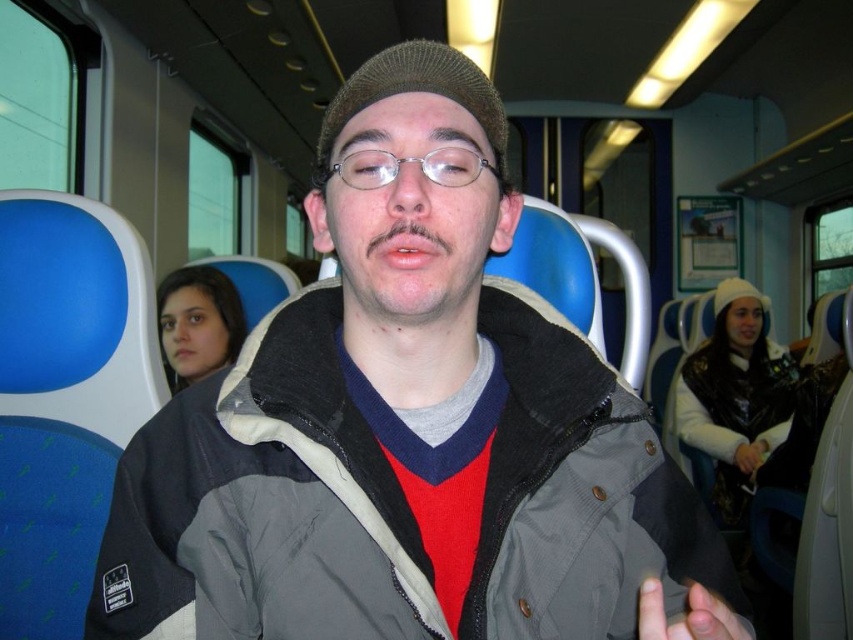
Question: Does clear plastic glasses at center have a smaller size compared to smooth skin hand at lower right?

Choices:
 (A) no
 (B) yes

Answer: (B)

Question: Does clear plastic glasses at center have a greater width compared to smooth skin hand at center?

Choices:
 (A) no
 (B) yes

Answer: (B)

Question: Estimate the real-world distances between objects in this image. Which object is farther from the smooth skin hand at center?

Choices:
 (A) clear plastic glasses at center
 (B) smooth skin hand at lower right

Answer: (A)

Question: Observing the image, what is the correct spatial positioning of clear plastic glasses at center in reference to smooth skin hand at center?

Choices:
 (A) right
 (B) left

Answer: (B)

Question: Which point appears farthest from the camera in this image?

Choices:
 (A) (758, 445)
 (B) (641, 614)
 (C) (471, 262)
 (D) (334, 168)

Answer: (A)

Question: Which object is farther from the camera taking this photo?

Choices:
 (A) smooth skin hand at lower right
 (B) clear plastic glasses at center
 (C) matte gray jacket at center
 (D) smooth skin hand at center

Answer: (D)